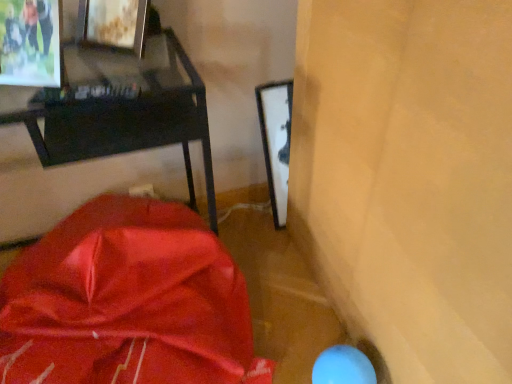
Question: Can you confirm if satin red blanket at lower left is thinner than metallic silver picture frame at upper left?

Choices:
 (A) no
 (B) yes

Answer: (A)

Question: From a real-world perspective, is satin red blanket at lower left located beneath metallic silver picture frame at upper left?

Choices:
 (A) yes
 (B) no

Answer: (A)

Question: Is satin red blanket at lower left positioned before metallic silver picture frame at upper left?

Choices:
 (A) no
 (B) yes

Answer: (B)

Question: Is satin red blanket at lower left at the right side of metallic silver picture frame at upper left?

Choices:
 (A) no
 (B) yes

Answer: (B)

Question: Is satin red blanket at lower left further to camera compared to metallic silver picture frame at upper left?

Choices:
 (A) yes
 (B) no

Answer: (B)

Question: Considering the positions of satin red blanket at lower left and matte black desk at upper left in the image, is satin red blanket at lower left bigger or smaller than matte black desk at upper left?

Choices:
 (A) small
 (B) big

Answer: (B)

Question: In the image, is satin red blanket at lower left positioned in front of or behind matte black desk at upper left?

Choices:
 (A) front
 (B) behind

Answer: (A)

Question: Based on their positions, is satin red blanket at lower left located to the left or right of matte black desk at upper left?

Choices:
 (A) right
 (B) left

Answer: (A)

Question: From the image's perspective, is satin red blanket at lower left located above or below matte black desk at upper left?

Choices:
 (A) below
 (B) above

Answer: (A)

Question: Is metallic silver picture frame at upper left inside or outside of matte black desk at upper left?

Choices:
 (A) outside
 (B) inside

Answer: (A)

Question: In terms of width, does metallic silver picture frame at upper left look wider or thinner when compared to matte black desk at upper left?

Choices:
 (A) wide
 (B) thin

Answer: (B)

Question: From the image's perspective, relative to matte black desk at upper left, is metallic silver picture frame at upper left above or below?

Choices:
 (A) below
 (B) above

Answer: (B)

Question: Based on their sizes in the image, would you say metallic silver picture frame at upper left is bigger or smaller than matte black desk at upper left?

Choices:
 (A) big
 (B) small

Answer: (B)

Question: Considering their positions, is matte black desk at upper left located in front of or behind metallic silver picture frame at upper left?

Choices:
 (A) behind
 (B) front

Answer: (B)

Question: In terms of size, does matte black desk at upper left appear bigger or smaller than metallic silver picture frame at upper left?

Choices:
 (A) big
 (B) small

Answer: (A)